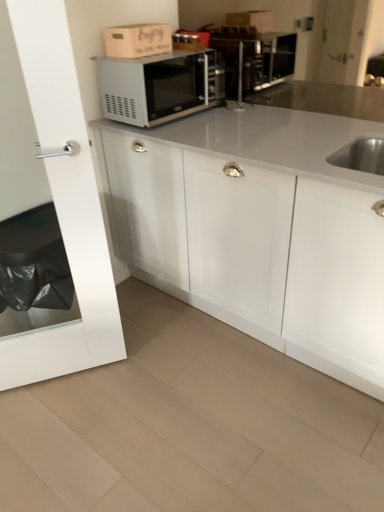
What are the coordinates of `vacant area that lies in front of transparent glass door at left` in the screenshot? It's located at (60, 431).